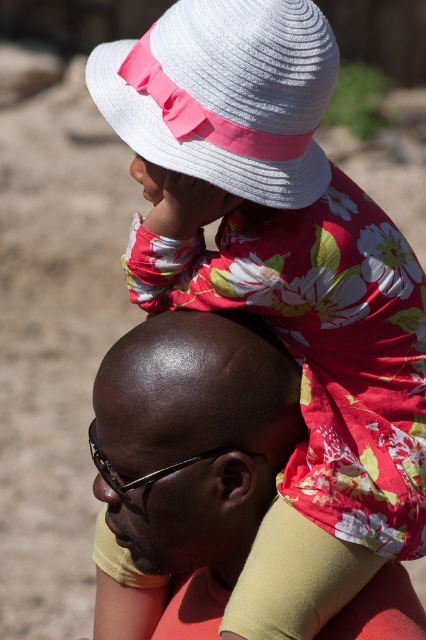
You are a photographer trying to capture a candid shot of the shiny bald head at center and the white woven hat at upper center. Since the bald head is smaller in size, how might you adjust your camera angle to ensure both objects are clearly visible in the frame?

The shiny bald head at center has a lesser width compared to the white woven hat at upper center. To ensure both are clearly visible, you could zoom out slightly to accommodate the larger size of the white woven hat at upper center while still framing the smaller shiny bald head at center adequately.

You are a photographer trying to capture the perfect shot of the shiny bald head at center and the white woven hat at upper center. Since you want to ensure both subjects are in focus, which object should you focus on first considering their heights?

The shiny bald head at center is taller than the white woven hat at upper center, so you should focus on the shiny bald head at center first to ensure both are in focus.